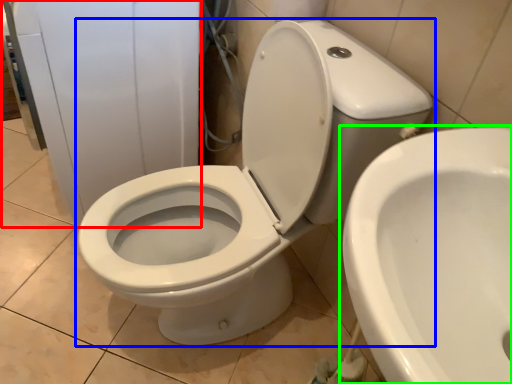
Question: Based on their relative distances, which object is farther from porcelain (highlighted by a red box)? Choose from toilet (highlighted by a blue box) and toilet (highlighted by a green box).

Choices:
 (A) toilet
 (B) toilet

Answer: (B)